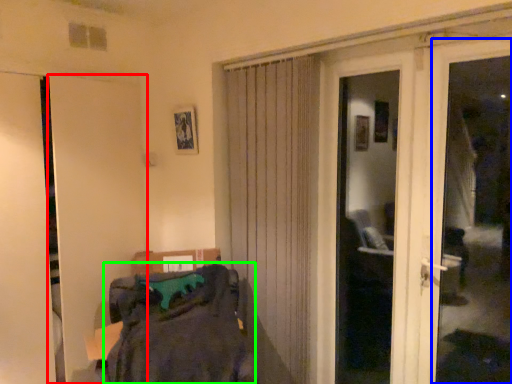
Question: Which object is the farthest from door (highlighted by a red box)? Choose among these: window frame (highlighted by a blue box) or laundry (highlighted by a green box).

Choices:
 (A) window frame
 (B) laundry

Answer: (A)